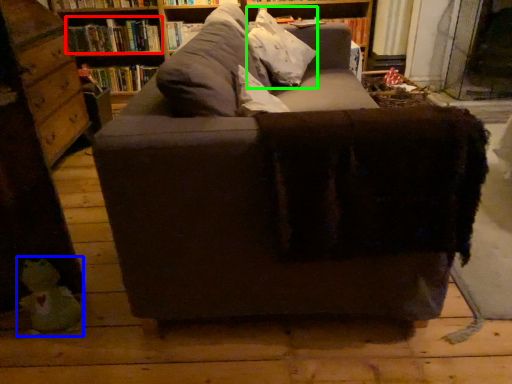
Question: Which object is positioned closest to book (highlighted by a red box)? Select from toy (highlighted by a blue box) and throw pillow (highlighted by a green box).

Choices:
 (A) toy
 (B) throw pillow

Answer: (B)